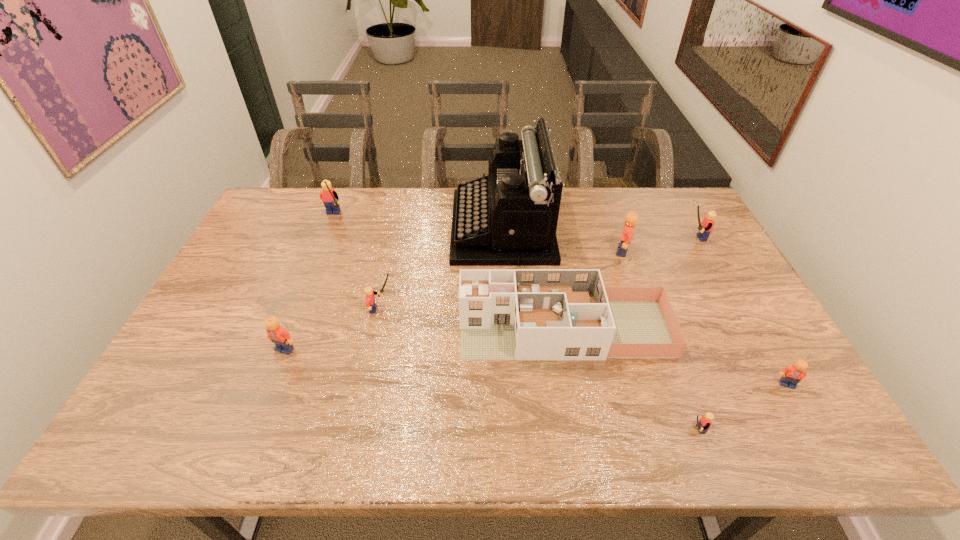
You are a GUI agent. You are given a task and a screenshot of the screen. Output one action in this format:
    pyautogui.click(x=<x>, y=<y>)
    Task: Click on the vacant region that satisfies the following two spatial constraints: 1. at the entrance of the dollhouse; 2. on the front-facing side of the second farthest orange Lego
    
    Given the screenshot: What is the action you would take?
    pyautogui.click(x=567, y=349)